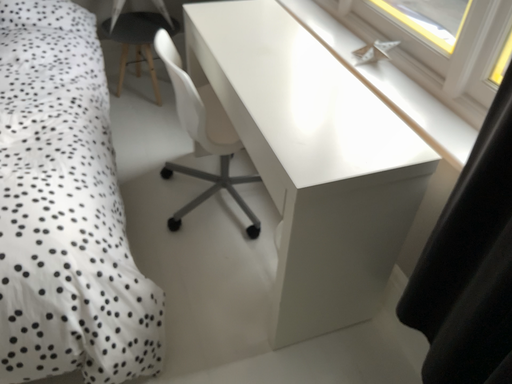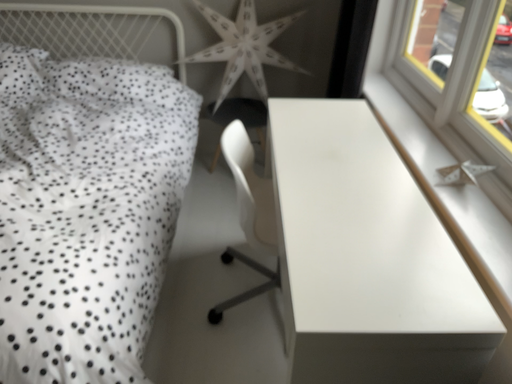
Question: Which way did the camera rotate in the video?

Choices:
 (A) rotated right
 (B) rotated left

Answer: (B)